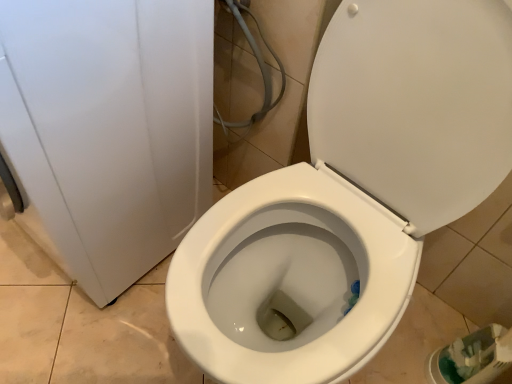
The image size is (512, 384). Find the location of `white glossy toilet at center`. white glossy toilet at center is located at coordinates (365, 176).

What is the approximate width of white glossy toilet at center?

25.54 inches.

The width and height of the screenshot is (512, 384). What do you see at coordinates (365, 176) in the screenshot? I see `white glossy toilet at center` at bounding box center [365, 176].

This screenshot has height=384, width=512. What do you see at coordinates (108, 129) in the screenshot? I see `white glossy toilet at center` at bounding box center [108, 129].

Find the location of a particular element. This screenshot has width=512, height=384. white glossy toilet at center is located at coordinates (108, 129).

You are a GUI agent. You are given a task and a screenshot of the screen. Output one action in this format:
    pyautogui.click(x=<x>, y=<y>)
    Task: Click on the white glossy toilet at center
    This screenshot has height=384, width=512.
    Given the screenshot: What is the action you would take?
    pyautogui.click(x=365, y=176)

Between white glossy toilet at center and white glossy toilet at center, which one appears on the left side from the viewer's perspective?

white glossy toilet at center.

Which object is further away from the camera, white glossy toilet at center or white glossy toilet at center?

white glossy toilet at center is further away from the camera.

Does point (331, 32) come behind point (75, 209)?

No, (331, 32) is in front of (75, 209).

From the image's perspective, is white glossy toilet at center above or below white glossy toilet at center?

Clearly, from the image's perspective, white glossy toilet at center is below white glossy toilet at center.

From a real-world perspective, which object rests below the other?

white glossy toilet at center, from a real-world perspective.

Which object is thinner, white glossy toilet at center or white glossy toilet at center?

white glossy toilet at center is thinner.

Between white glossy toilet at center and white glossy toilet at center, which one has less height?

Standing shorter between the two is white glossy toilet at center.

Is white glossy toilet at center bigger or smaller than white glossy toilet at center?

Considering their sizes, white glossy toilet at center takes up less space than white glossy toilet at center.

Consider the image. Can we say white glossy toilet at center lies outside white glossy toilet at center?

Yes.

Is white glossy toilet at center next to white glossy toilet at center?

No, white glossy toilet at center is not touching white glossy toilet at center.

Is white glossy toilet at center aimed at white glossy toilet at center?

No, white glossy toilet at center is not facing towards white glossy toilet at center.

The height and width of the screenshot is (384, 512). I want to click on porcelain below the white glossy toilet at center (from a real-world perspective), so click(108, 129).

Which object is positioned more to the left, white glossy toilet at center or white glossy toilet at center?

Positioned to the left is white glossy toilet at center.

Considering the relative positions of white glossy toilet at center and white glossy toilet at center in the image provided, is white glossy toilet at center behind white glossy toilet at center?

Yes, white glossy toilet at center is further from the camera.

Which is closer, (x=110, y=112) or (x=327, y=228)?

Point (x=110, y=112)

From the image's perspective, is white glossy toilet at center positioned above or below white glossy toilet at center?

white glossy toilet at center is above white glossy toilet at center.

From a real-world perspective, is white glossy toilet at center beneath white glossy toilet at center?

Yes, from a real-world perspective, white glossy toilet at center is beneath white glossy toilet at center.

Which of these two, white glossy toilet at center or white glossy toilet at center, is wider?

white glossy toilet at center.

Is white glossy toilet at center taller than white glossy toilet at center?

No.

Based on the photo, which of these two, white glossy toilet at center or white glossy toilet at center, is bigger?

white glossy toilet at center is bigger.

Is white glossy toilet at center inside or outside of white glossy toilet at center?

The correct answer is: outside.

Is white glossy toilet at center in contact with white glossy toilet at center?

white glossy toilet at center and white glossy toilet at center are not in contact.

Is white glossy toilet at center turned away from white glossy toilet at center?

white glossy toilet at center is not turned away from white glossy toilet at center.

What's the angular difference between white glossy toilet at center and white glossy toilet at center's facing directions?

There is a 0.485-degree angle between the facing directions of white glossy toilet at center and white glossy toilet at center.

There is a white glossy toilet at center. At what (x,y) coordinates should I click in order to perform the action: click on toilet above it (from a real-world perspective). Please return your answer as a coordinate pair (x, y). The width and height of the screenshot is (512, 384). Looking at the image, I should click on (365, 176).

There is a white glossy toilet at center. Where is `toilet above it (from a real-world perspective)`? The width and height of the screenshot is (512, 384). toilet above it (from a real-world perspective) is located at coordinates (365, 176).

At what (x,y) coordinates should I click in order to perform the action: click on porcelain above the white glossy toilet at center (from the image's perspective). Please return your answer as a coordinate pair (x, y). Looking at the image, I should click on (108, 129).